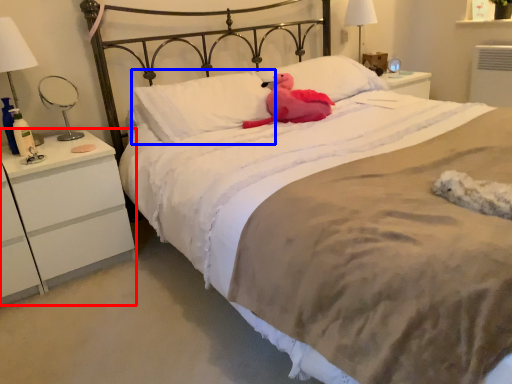
Question: Among these objects, which one is nearest to the camera, nightstand (highlighted by a red box) or pillow (highlighted by a blue box)?

Choices:
 (A) nightstand
 (B) pillow

Answer: (A)